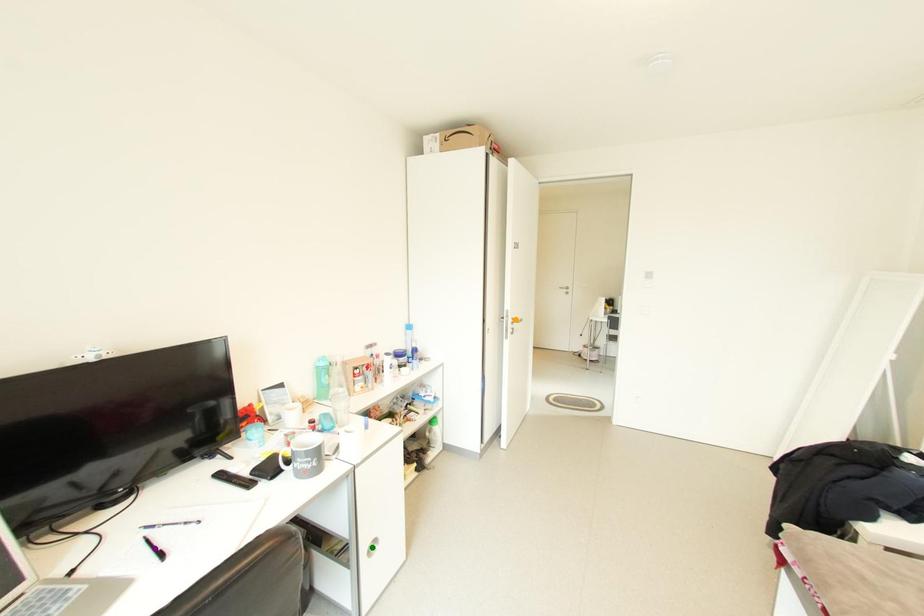
Order these from farthest to nearest:
1. purple point
2. green point
3. orange point

1. orange point
2. green point
3. purple point